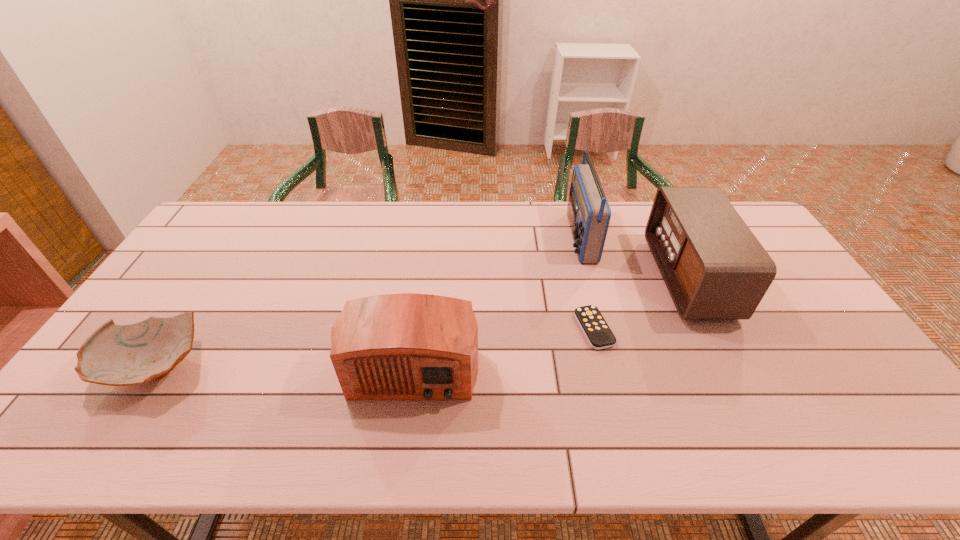
In the image, there is a desktop. Where is `vacant space at the far left corner`? Image resolution: width=960 pixels, height=540 pixels. vacant space at the far left corner is located at coordinates (230, 237).

Locate an element on the screen. The width and height of the screenshot is (960, 540). free space between the second shortest object and the second object from left to right is located at coordinates click(x=286, y=364).

Image resolution: width=960 pixels, height=540 pixels. I want to click on empty space between the leftmost radio receiver and the second shortest object, so click(x=286, y=364).

Locate an element on the screen. free area in between the second object from left to right and the rightmost radio receiver is located at coordinates (551, 320).

You are a GUI agent. You are given a task and a screenshot of the screen. Output one action in this format:
    pyautogui.click(x=<x>, y=<y>)
    Task: Click on the vacant region between the rightmost object and the second radio receiver from left to right
    
    Given the screenshot: What is the action you would take?
    pyautogui.click(x=634, y=258)

At what (x,y) coordinates should I click in order to perform the action: click on unoccupied area between the second radio receiver from left to right and the rightmost object. Please return your answer as a coordinate pair (x, y). Looking at the image, I should click on (634, 258).

Where is `vacant point located between the remote control and the rightmost radio receiver`? vacant point located between the remote control and the rightmost radio receiver is located at coordinates (641, 303).

Where is `free space between the second radio receiver from right to left and the rightmost object`? The height and width of the screenshot is (540, 960). free space between the second radio receiver from right to left and the rightmost object is located at coordinates (634, 258).

You are a GUI agent. You are given a task and a screenshot of the screen. Output one action in this format:
    pyautogui.click(x=<x>, y=<y>)
    Task: Click on the free point between the leftmost radio receiver and the shortest object
    
    Given the screenshot: What is the action you would take?
    pyautogui.click(x=504, y=346)

Where is `vacant area between the second radio receiver from left to right and the shortest object`? vacant area between the second radio receiver from left to right and the shortest object is located at coordinates 587,283.